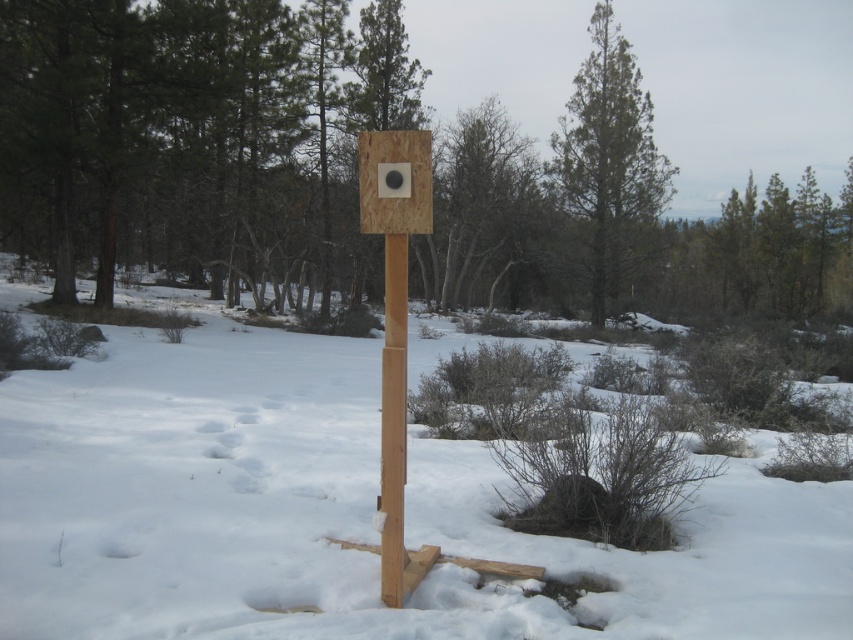
Question: In this image, where is white snow at center located relative to light brown wood post at center?

Choices:
 (A) right
 (B) left

Answer: (B)

Question: Considering the relative positions of white snow at center and matte wood sign at center in the image provided, where is white snow at center located with respect to matte wood sign at center?

Choices:
 (A) below
 (B) above

Answer: (A)

Question: Which object is the closest to the green coniferous tree at upper center?

Choices:
 (A) light brown wood post at center
 (B) white snow at center

Answer: (B)

Question: Which point is closer to the camera?

Choices:
 (A) (393, 424)
 (B) (253, 356)
 (C) (381, 132)

Answer: (C)

Question: Observing the image, what is the correct spatial positioning of white snow at center in reference to light brown wood post at center?

Choices:
 (A) left
 (B) right

Answer: (A)

Question: Which point is farther to the camera?

Choices:
 (A) green coniferous tree at upper center
 (B) white snow at center
 (C) matte wood sign at center
 (D) light brown wood post at center

Answer: (A)